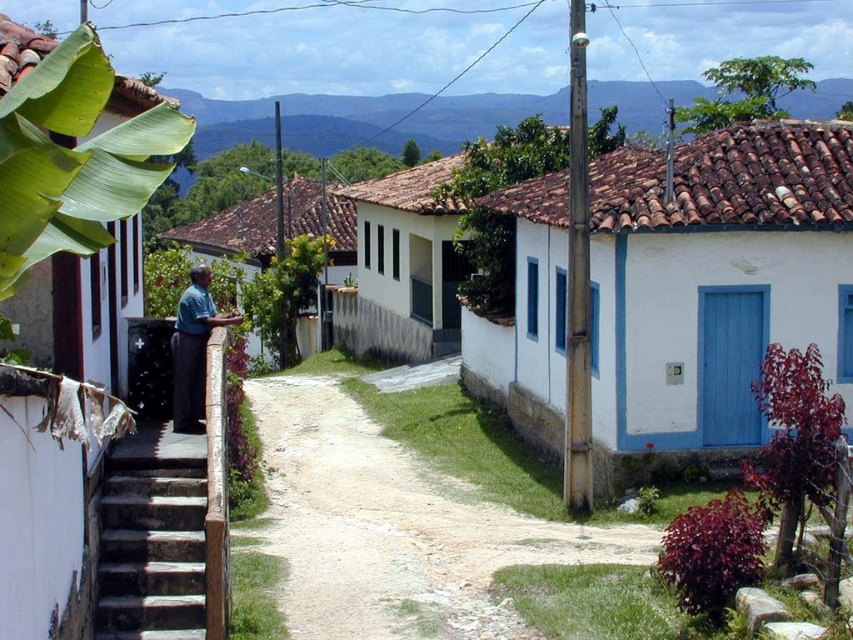
Question: Can you confirm if dirt path at center is positioned below dark blue fabric shirt at left?

Choices:
 (A) no
 (B) yes

Answer: (B)

Question: Which of the following is the farthest from the observer?

Choices:
 (A) (192, 300)
 (B) (113, 618)

Answer: (A)

Question: Which point appears closest to the camera in this image?

Choices:
 (A) (630, 548)
 (B) (196, 598)
 (C) (206, 296)

Answer: (B)

Question: Is dirt path at center closer to the viewer compared to dark gray concrete stairs at lower left?

Choices:
 (A) yes
 (B) no

Answer: (B)

Question: Which of these objects is positioned farthest from the dark gray concrete stairs at lower left?

Choices:
 (A) dirt path at center
 (B) dark blue fabric shirt at left

Answer: (A)

Question: Is dark gray concrete stairs at lower left bigger than dark blue fabric shirt at left?

Choices:
 (A) yes
 (B) no

Answer: (A)